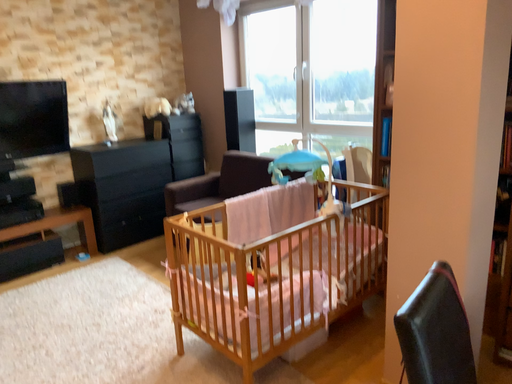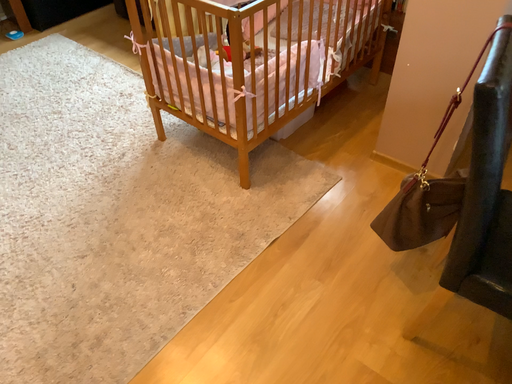
Question: Which way did the camera rotate in the video?

Choices:
 (A) rotated downward
 (B) rotated upward

Answer: (A)